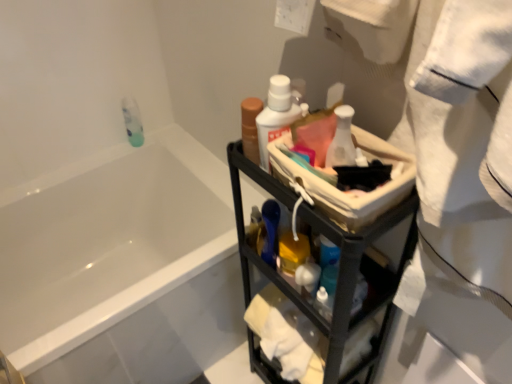
Question: Is white glossy bottle at center closer to the viewer compared to black metal cart at center?

Choices:
 (A) yes
 (B) no

Answer: (B)

Question: Considering the relative positions of white glossy bottle at center and black metal cart at center in the image provided, is white glossy bottle at center to the left of black metal cart at center from the viewer's perspective?

Choices:
 (A) yes
 (B) no

Answer: (A)

Question: Is black metal cart at center inside white glossy bottle at center?

Choices:
 (A) yes
 (B) no

Answer: (B)

Question: Is white glossy bottle at center positioned behind black metal cart at center?

Choices:
 (A) no
 (B) yes

Answer: (B)

Question: From the image's perspective, is white glossy bottle at center below black metal cart at center?

Choices:
 (A) no
 (B) yes

Answer: (A)

Question: In the image, is matte brown bottle at upper right, which ranks as the second mouthwash in back-to-front order, positioned in front of or behind white cotton towel at right?

Choices:
 (A) behind
 (B) front

Answer: (A)

Question: From a real-world perspective, relative to white cotton towel at right, is matte brown bottle at upper right, which ranks as the second mouthwash in back-to-front order, vertically above or below?

Choices:
 (A) below
 (B) above

Answer: (A)

Question: Is matte brown bottle at upper right, which is counted as the second mouthwash, starting from the right, to the left or to the right of white cotton towel at right in the image?

Choices:
 (A) left
 (B) right

Answer: (A)

Question: From the image's perspective, is matte brown bottle at upper right, which is counted as the second mouthwash, starting from the right, located above or below white cotton towel at right?

Choices:
 (A) above
 (B) below

Answer: (A)

Question: Considering the positions of white glossy bottle at center and black metal cart at center in the image, is white glossy bottle at center taller or shorter than black metal cart at center?

Choices:
 (A) short
 (B) tall

Answer: (A)

Question: Is white glossy bottle at center bigger or smaller than black metal cart at center?

Choices:
 (A) small
 (B) big

Answer: (A)

Question: From a real-world perspective, is white glossy bottle at center above or below black metal cart at center?

Choices:
 (A) above
 (B) below

Answer: (A)

Question: From the image's perspective, relative to black metal cart at center, is white glossy bottle at center above or below?

Choices:
 (A) above
 (B) below

Answer: (A)

Question: In the image, is white glossy bottle at center positioned in front of or behind white cotton towel at right?

Choices:
 (A) front
 (B) behind

Answer: (B)

Question: Considering the positions of point (349, 155) and point (366, 41), is point (349, 155) closer or farther from the camera than point (366, 41)?

Choices:
 (A) closer
 (B) farther

Answer: (B)